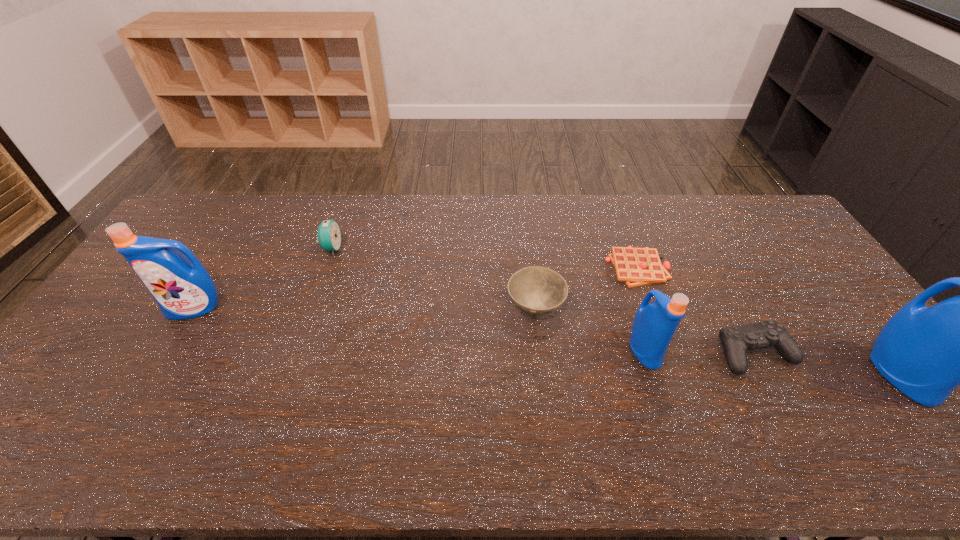
Locate an element on the screen. The height and width of the screenshot is (540, 960). free space that satisfies the following two spatial constraints: 1. on the front-facing side of the second object from left to right; 2. on the right side of the waffle is located at coordinates (324, 268).

This screenshot has height=540, width=960. What are the coordinates of `blank space that satisfies the following two spatial constraints: 1. on the front side of the second object from right to left; 2. on the right side of the fifth tallest object` in the screenshot? It's located at (540, 353).

Where is `vacant area in the image that satisfies the following two spatial constraints: 1. on the front-facing side of the alarm clock; 2. on the left side of the third shortest object`? This screenshot has height=540, width=960. vacant area in the image that satisfies the following two spatial constraints: 1. on the front-facing side of the alarm clock; 2. on the left side of the third shortest object is located at coordinates (310, 308).

The height and width of the screenshot is (540, 960). Identify the location of vacant position in the image that satisfies the following two spatial constraints: 1. on the label of the sixth object from left to right; 2. on the left side of the second shortest detergent. (168, 353).